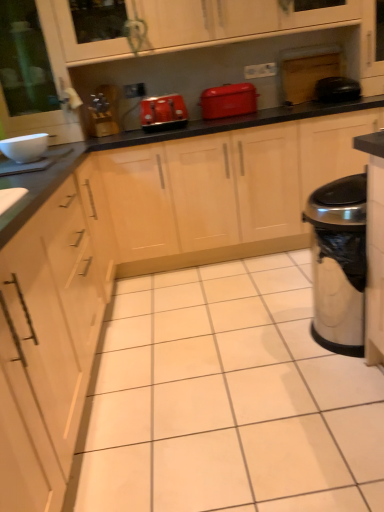
Question: Should I look upward or downward to see matte plastic toaster at center?

Choices:
 (A) down
 (B) up

Answer: (B)

Question: Can you confirm if white glossy bowl at upper left, which ranks as the second appliance in top-to-bottom order, is positioned to the left of matte wood cabinet at upper center?

Choices:
 (A) yes
 (B) no

Answer: (A)

Question: From a real-world perspective, does white glossy bowl at upper left, acting as the first appliance starting from the left, sit lower than matte wood cabinet at upper center?

Choices:
 (A) no
 (B) yes

Answer: (B)

Question: Is white glossy bowl at upper left, the first appliance in the bottom-to-top sequence, aimed at matte wood cabinet at upper center?

Choices:
 (A) yes
 (B) no

Answer: (B)

Question: Is the position of white glossy bowl at upper left, which appears as the second appliance when viewed from the back, less distant than that of matte wood cabinet at upper center?

Choices:
 (A) yes
 (B) no

Answer: (A)

Question: From a real-world perspective, is white glossy bowl at upper left, which appears as the second appliance when viewed from the back, physically above matte wood cabinet at upper center?

Choices:
 (A) yes
 (B) no

Answer: (B)

Question: Considering the relative sizes of white glossy bowl at upper left, which appears as the second appliance when viewed from the back, and matte wood cabinet at upper center in the image provided, is white glossy bowl at upper left, which appears as the second appliance when viewed from the back, thinner than matte wood cabinet at upper center?

Choices:
 (A) yes
 (B) no

Answer: (A)

Question: Is black rubber trash can at right, the first appliance viewed from the top, smaller than black glossy countertop at center?

Choices:
 (A) no
 (B) yes

Answer: (B)

Question: Considering the relative sizes of black rubber trash can at right, the first appliance viewed from the top, and black glossy countertop at center in the image provided, is black rubber trash can at right, the first appliance viewed from the top, wider than black glossy countertop at center?

Choices:
 (A) yes
 (B) no

Answer: (B)

Question: Is black rubber trash can at right, placed as the second appliance when sorted from bottom to top, bigger than black glossy countertop at center?

Choices:
 (A) yes
 (B) no

Answer: (B)

Question: Is black rubber trash can at right, positioned as the 2th appliance in left-to-right order, at the left side of black glossy countertop at center?

Choices:
 (A) no
 (B) yes

Answer: (A)

Question: Would you consider black rubber trash can at right, placed as the second appliance when sorted from bottom to top, to be distant from black glossy countertop at center?

Choices:
 (A) yes
 (B) no

Answer: (B)

Question: Is black rubber trash can at right, the 2th appliance positioned from the front, not inside black glossy countertop at center?

Choices:
 (A) yes
 (B) no

Answer: (A)

Question: Is white glossy bowl at upper left, which appears as the second appliance when viewed from the back, located within matte red toaster at center?

Choices:
 (A) yes
 (B) no

Answer: (B)